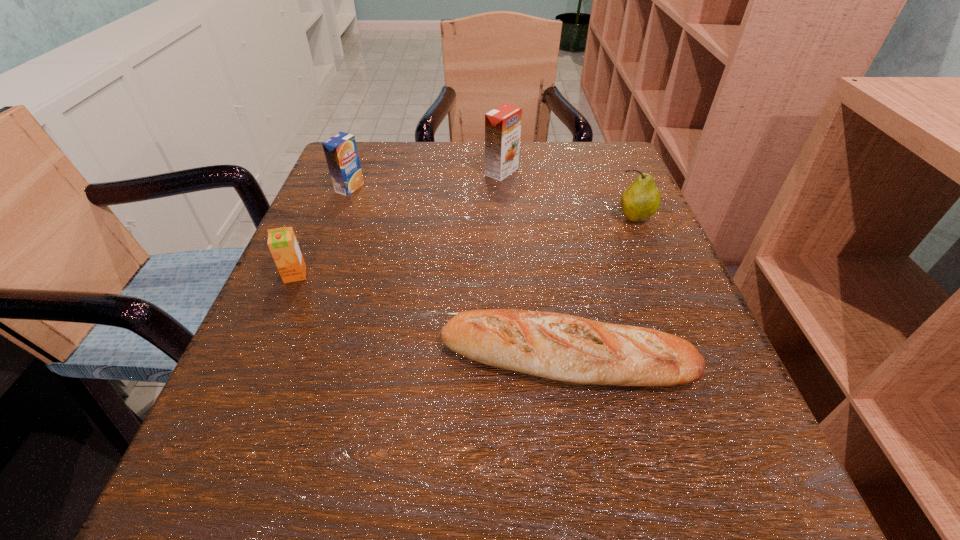
At what (x,y) coordinates should I click in order to perform the action: click on free area in between the nearest orange juice and the rightmost orange juice. Please return your answer as a coordinate pair (x, y). The height and width of the screenshot is (540, 960). Looking at the image, I should click on (398, 223).

Locate an element on the screen. This screenshot has width=960, height=540. vacant area that lies between the nearest object and the pear is located at coordinates (600, 287).

At what (x,y) coordinates should I click in order to perform the action: click on free area in between the fourth farthest object and the shortest object. Please return your answer as a coordinate pair (x, y). This screenshot has height=540, width=960. Looking at the image, I should click on (430, 315).

Where is `vacant space that's between the rightmost orange juice and the nearest object`? vacant space that's between the rightmost orange juice and the nearest object is located at coordinates (534, 264).

Locate an element on the screen. This screenshot has height=540, width=960. empty space that is in between the second nearest object and the rightmost orange juice is located at coordinates (398, 223).

I want to click on free space between the second nearest object and the tallest object, so click(398, 223).

Where is `empty space that is in between the tallest orange juice and the nearest orange juice`? The height and width of the screenshot is (540, 960). empty space that is in between the tallest orange juice and the nearest orange juice is located at coordinates (398, 223).

Identify which object is the fourth nearest to the tallest object. Please provide its 2D coordinates. Your answer should be formatted as a tuple, i.e. [(x, y)], where the tuple contains the x and y coordinates of a point satisfying the conditions above.

[(282, 242)]

In order to click on the closest object to the nearest orange juice in this screenshot , I will do `click(340, 150)`.

Select which orange juice appears as the second closest to the tallest orange juice. Please provide its 2D coordinates. Your answer should be formatted as a tuple, i.e. [(x, y)], where the tuple contains the x and y coordinates of a point satisfying the conditions above.

[(282, 242)]